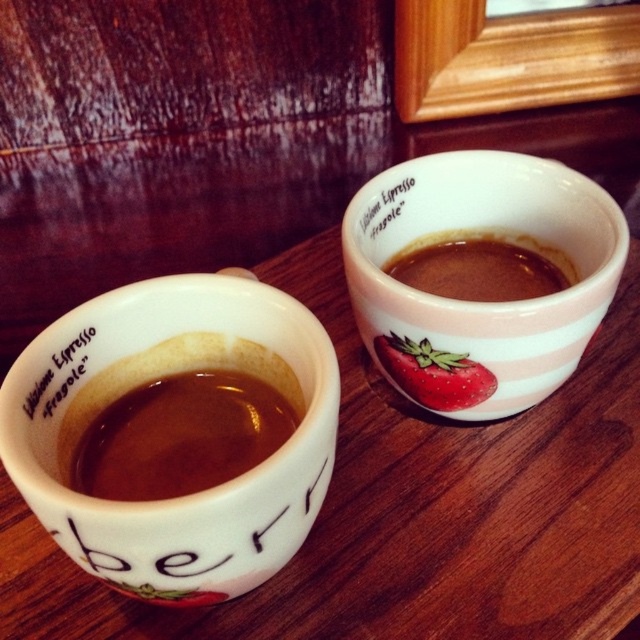
You are a barista arranging items on a counter and need to place a new menu card between the white matte espresso cup at left and the white matte text at upper left. The menu card is 6 inches wide. Will it fit between them?

The white matte espresso cup at left and white matte text at upper left are 5.91 inches apart from each other. Since the menu card is 6 inches wide, it will not fit between them as the space is slightly narrower than the card.